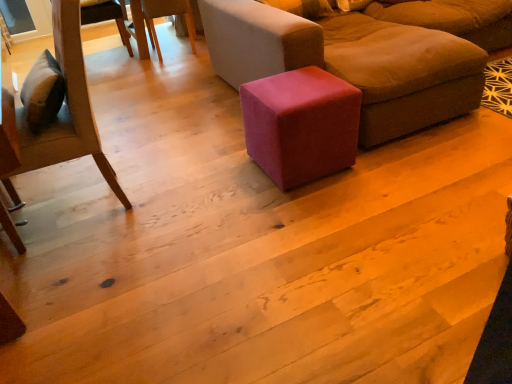
Question: From a real-world perspective, is wooden chair at upper left, the 1th chair positioned from the back, physically located above or below velvet pink cube at center?

Choices:
 (A) below
 (B) above

Answer: (B)

Question: In the image, is wooden chair at upper left, placed as the 2th chair when sorted from bottom to top, on the left side or the right side of velvet pink cube at center?

Choices:
 (A) right
 (B) left

Answer: (B)

Question: Which is nearer to the velvet pink cube at center?

Choices:
 (A) velvet brown ottoman at center
 (B) wooden chair at left, the second chair in the back-to-front sequence
 (C) wooden chair at upper left, placed as the 2th chair when sorted from bottom to top

Answer: (A)

Question: Which of these objects is positioned farthest from the wooden chair at upper left, the 1th chair positioned from the back?

Choices:
 (A) wooden chair at left, which appears as the 1th chair when viewed from the front
 (B) velvet brown ottoman at center
 (C) velvet pink cube at center

Answer: (A)